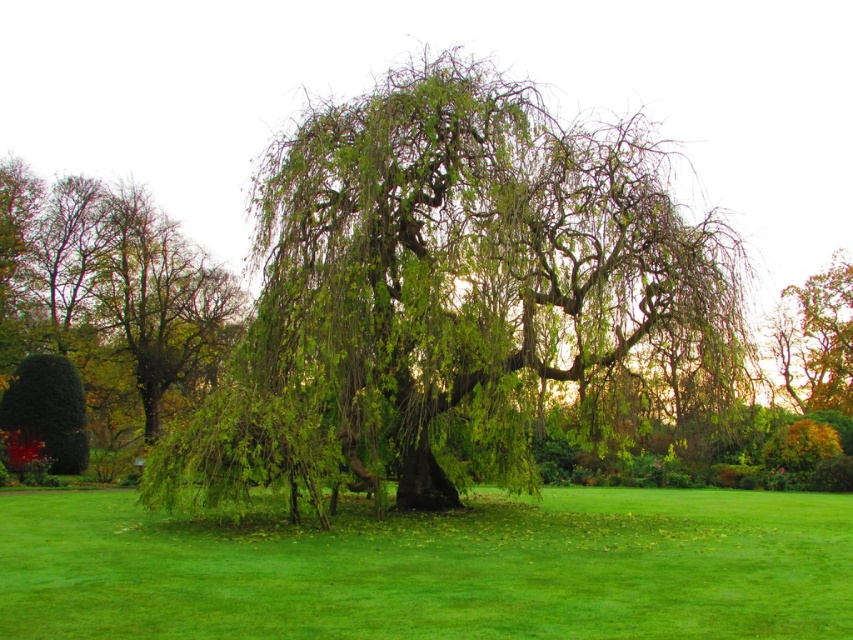
Question: Does green grass at center have a smaller size compared to green leafy tree at left?

Choices:
 (A) yes
 (B) no

Answer: (A)

Question: Which object is the closest to the green leafy tree at upper right?

Choices:
 (A) green leafy willow at center
 (B) green leafy tree at left

Answer: (A)

Question: Which object is farther from the camera taking this photo?

Choices:
 (A) green leafy willow at center
 (B) green grass at center

Answer: (A)

Question: Is the position of green leafy willow at center less distant than that of green grass at center?

Choices:
 (A) no
 (B) yes

Answer: (A)

Question: Which of these objects is positioned farthest from the green leafy willow at center?

Choices:
 (A) green grass at center
 (B) green leafy tree at left
 (C) green leafy tree at upper right

Answer: (C)

Question: Can you confirm if green leafy willow at center is positioned to the right of green leafy tree at left?

Choices:
 (A) yes
 (B) no

Answer: (A)